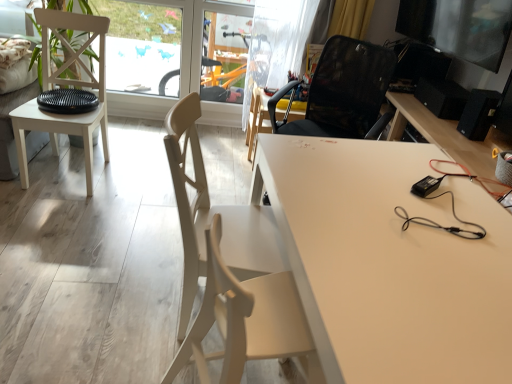
This screenshot has width=512, height=384. I want to click on free space to the left of matte white chair at center, which ranks as the 2th chair in front-to-back order, so click(x=120, y=292).